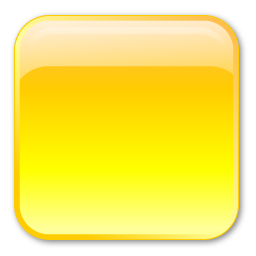
The image size is (256, 256). Find the location of `dark gold trim`. dark gold trim is located at coordinates (203, 18).